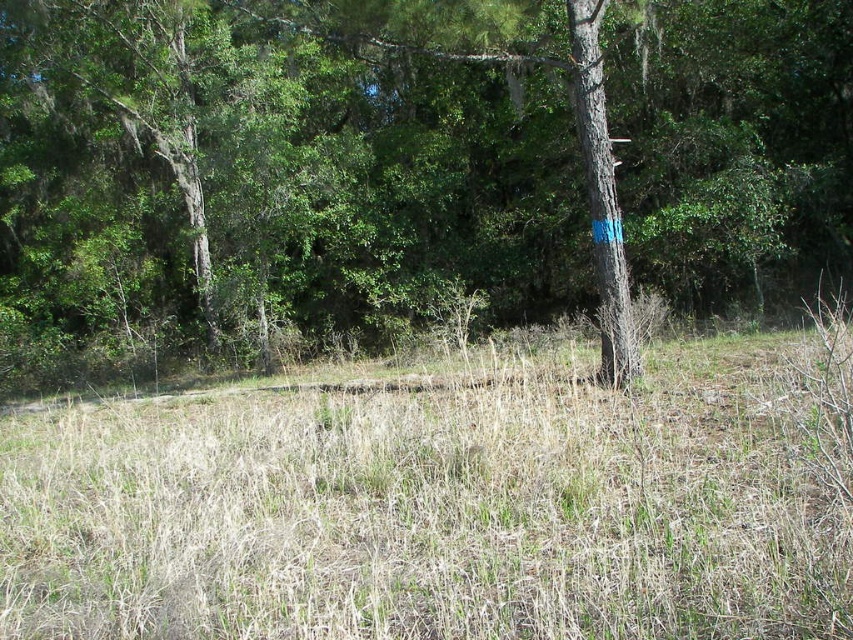
Question: Does green rough bark tree at center appear on the right side of dry grass at center?

Choices:
 (A) no
 (B) yes

Answer: (A)

Question: Which point is farther from the camera taking this photo?

Choices:
 (A) (212, 563)
 (B) (279, 97)

Answer: (B)

Question: Among these points, which one is nearest to the camera?

Choices:
 (A) (379, 214)
 (B) (177, 554)

Answer: (B)

Question: From the image, what is the correct spatial relationship of green rough bark tree at center in relation to dry grass at center?

Choices:
 (A) above
 (B) below

Answer: (A)

Question: Is green rough bark tree at center further to camera compared to dry grass at center?

Choices:
 (A) yes
 (B) no

Answer: (A)